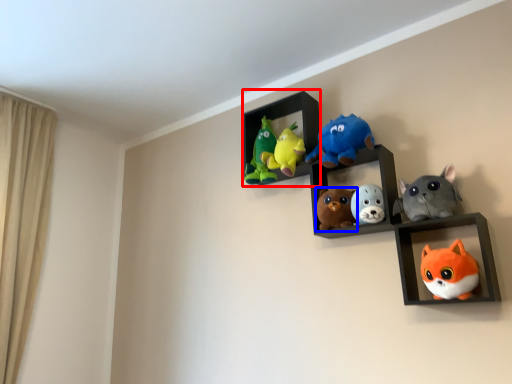
Question: Among these objects, which one is nearest to the camera, cabinet (highlighted by a red box) or toy (highlighted by a blue box)?

Choices:
 (A) cabinet
 (B) toy

Answer: (B)